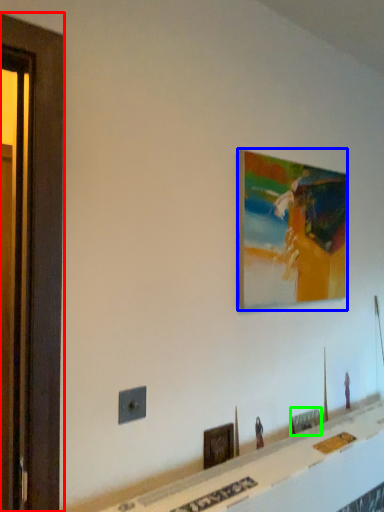
Question: Based on their relative distances, which object is farther from screen door (highlighted by a red box)? Choose from picture frame (highlighted by a blue box) and picture frame (highlighted by a green box).

Choices:
 (A) picture frame
 (B) picture frame

Answer: (B)